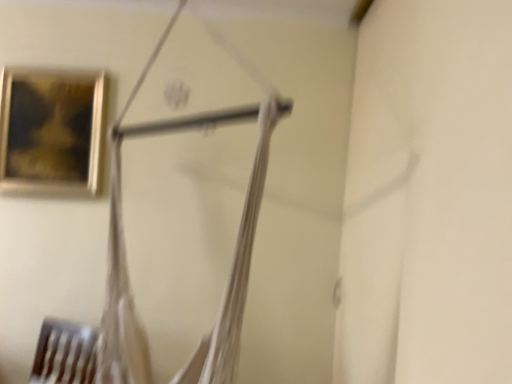
Where is `gold-framed painting at upper left`? gold-framed painting at upper left is located at coordinates (51, 132).

What do you see at coordinates (51, 132) in the screenshot? The width and height of the screenshot is (512, 384). I see `gold-framed painting at upper left` at bounding box center [51, 132].

The image size is (512, 384). What do you see at coordinates (234, 255) in the screenshot? I see `white fabric hanger at center` at bounding box center [234, 255].

Where is `white fabric hanger at center`? Image resolution: width=512 pixels, height=384 pixels. white fabric hanger at center is located at coordinates (234, 255).

You are a GUI agent. You are given a task and a screenshot of the screen. Output one action in this format:
    pyautogui.click(x=<x>, y=<y>)
    Task: Click on the gold-framed painting at upper left
    The height and width of the screenshot is (384, 512).
    Given the screenshot: What is the action you would take?
    pyautogui.click(x=51, y=132)

Based on their positions, is white fabric hanger at center located to the left or right of gold-framed painting at upper left?

Based on their positions, white fabric hanger at center is located to the right of gold-framed painting at upper left.

Is white fabric hanger at center in front of or behind gold-framed painting at upper left in the image?

Visually, white fabric hanger at center is located in front of gold-framed painting at upper left.

Which point is more distant from viewer, (256,118) or (3,188)?

The point (256,118) is more distant.

From the image's perspective, which is below, white fabric hanger at center or gold-framed painting at upper left?

white fabric hanger at center, from the image's perspective.

From a real-world perspective, between white fabric hanger at center and gold-framed painting at upper left, who is vertically lower?

From a 3D spatial view, white fabric hanger at center is below.

Is white fabric hanger at center wider than gold-framed painting at upper left?

Yes, white fabric hanger at center is wider than gold-framed painting at upper left.

Does white fabric hanger at center have a greater height compared to gold-framed painting at upper left?

Indeed, white fabric hanger at center has a greater height compared to gold-framed painting at upper left.

Considering the sizes of objects white fabric hanger at center and gold-framed painting at upper left in the image provided, who is smaller, white fabric hanger at center or gold-framed painting at upper left?

With smaller size is gold-framed painting at upper left.

Looking at this image, choose the correct answer: Is white fabric hanger at center inside gold-framed painting at upper left or outside it?

The correct answer is: outside.

Is white fabric hanger at center not close to gold-framed painting at upper left?

No.

Is white fabric hanger at center aimed at gold-framed painting at upper left?

No.

Measure the distance from white fabric hanger at center to gold-framed painting at upper left.

16.53 inches.

The width and height of the screenshot is (512, 384). In order to click on picture frame behind the white fabric hanger at center in this screenshot , I will do `click(51, 132)`.

Considering the relative positions of gold-framed painting at upper left and white fabric hanger at center in the image provided, is gold-framed painting at upper left to the left or to the right of white fabric hanger at center?

From the image, it's evident that gold-framed painting at upper left is to the left of white fabric hanger at center.

Considering their positions, is gold-framed painting at upper left located in front of or behind white fabric hanger at center?

In the image, gold-framed painting at upper left appears behind white fabric hanger at center.

Which is farther from the camera, (36, 165) or (239, 276)?

Positioned behind is point (36, 165).

From the image's perspective, is gold-framed painting at upper left positioned above or below white fabric hanger at center?

From the image's perspective, gold-framed painting at upper left appears above white fabric hanger at center.

From a real-world perspective, who is located lower, gold-framed painting at upper left or white fabric hanger at center?

white fabric hanger at center.

Considering the sizes of gold-framed painting at upper left and white fabric hanger at center in the image, is gold-framed painting at upper left wider or thinner than white fabric hanger at center?

gold-framed painting at upper left is thinner than white fabric hanger at center.

Considering the relative sizes of gold-framed painting at upper left and white fabric hanger at center in the image provided, is gold-framed painting at upper left shorter than white fabric hanger at center?

Indeed, gold-framed painting at upper left has a lesser height compared to white fabric hanger at center.

Looking at the image, does gold-framed painting at upper left seem bigger or smaller compared to white fabric hanger at center?

Considering their sizes, gold-framed painting at upper left takes up less space than white fabric hanger at center.

Is white fabric hanger at center a part of gold-framed painting at upper left?

No, white fabric hanger at center is located outside of gold-framed painting at upper left.

Is the surface of gold-framed painting at upper left in direct contact with white fabric hanger at center?

There is a gap between gold-framed painting at upper left and white fabric hanger at center.

From the picture: Is gold-framed painting at upper left turned away from white fabric hanger at center?

No, white fabric hanger at center is not at the back of gold-framed painting at upper left.

How many degrees apart are the facing directions of gold-framed painting at upper left and white fabric hanger at center?

The angular difference between gold-framed painting at upper left and white fabric hanger at center is 51.3 degrees.

Measure the distance from gold-framed painting at upper left to white fabric hanger at center.

A distance of 16.53 inches exists between gold-framed painting at upper left and white fabric hanger at center.

Identify the location of hanger directly beneath the gold-framed painting at upper left (from a real-world perspective). (234, 255).

Identify the location of picture frame on the left of white fabric hanger at center. (51, 132).

The width and height of the screenshot is (512, 384). I want to click on picture frame above the white fabric hanger at center (from the image's perspective), so click(51, 132).